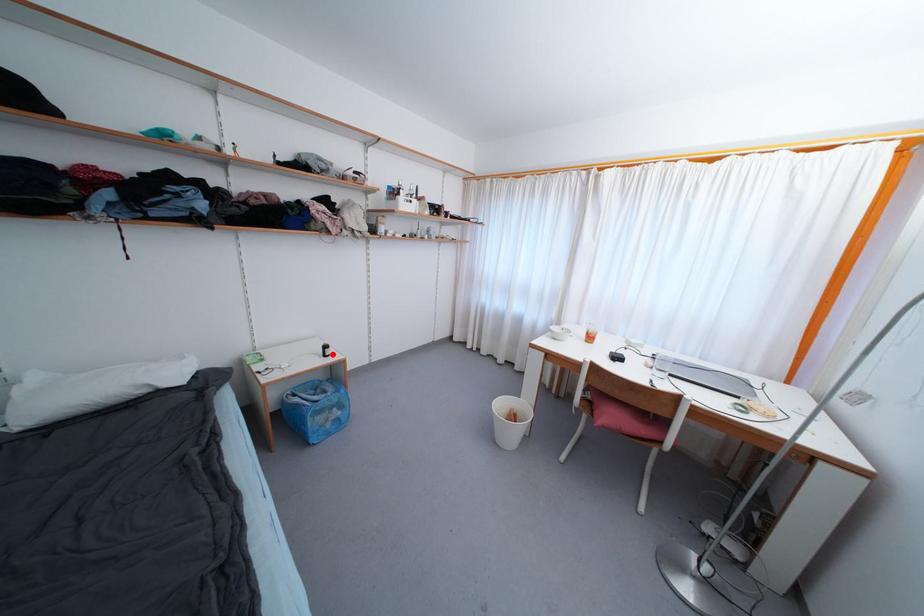
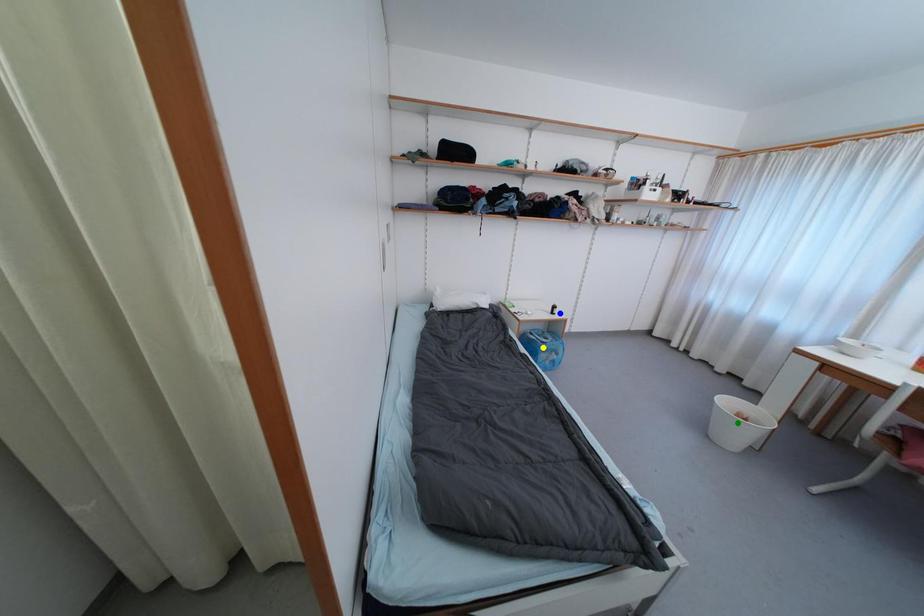
Question: I am providing you with two images of the same scene from different viewpoints. A red point is marked on the first image. You are given multiple points on the second image. Can you choose the point in image 2 that corresponds to the point in image 1?

Choices:
 (A) yellow point
 (B) green point
 (C) blue point

Answer: (C)